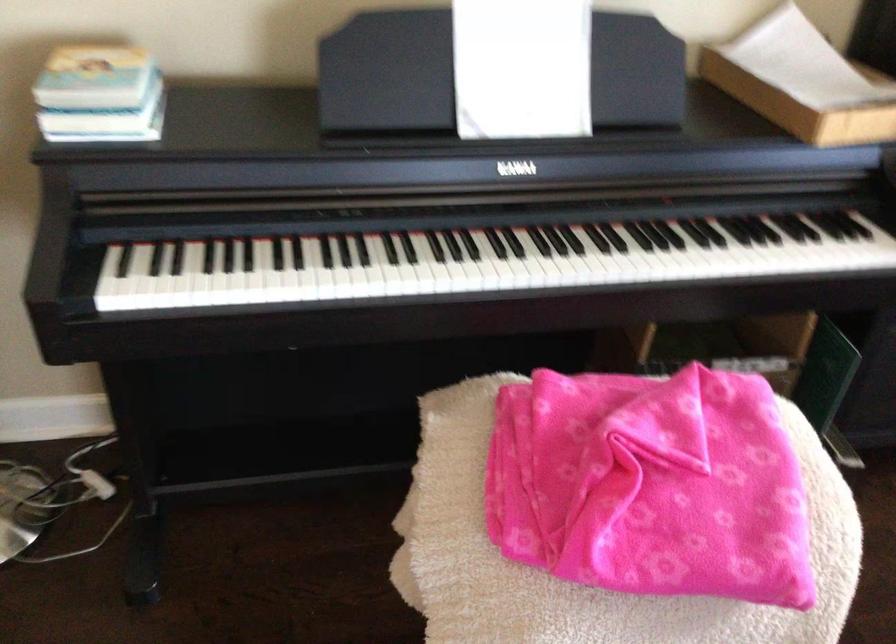
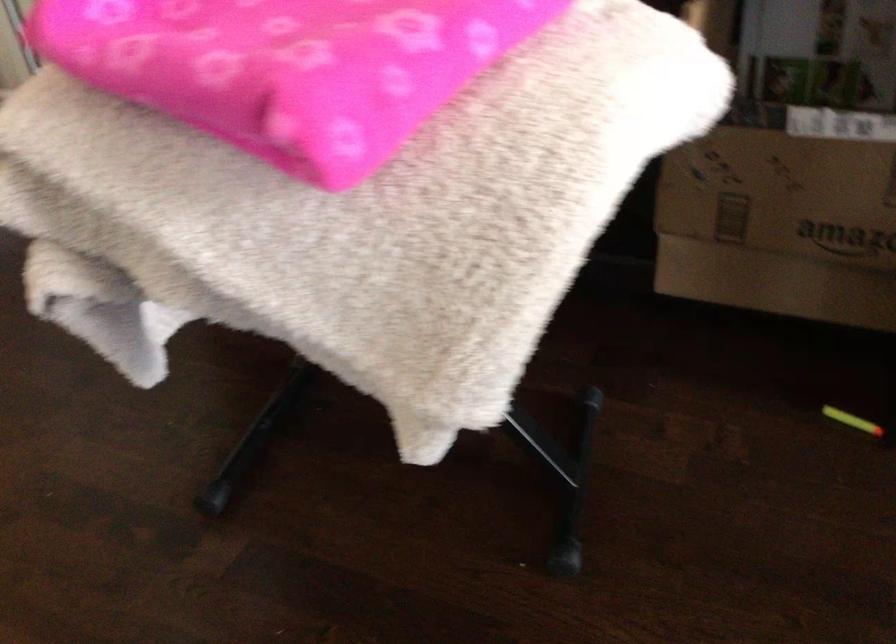
Find the pixel in the second image that matches point (781, 560) in the first image.

(288, 67)